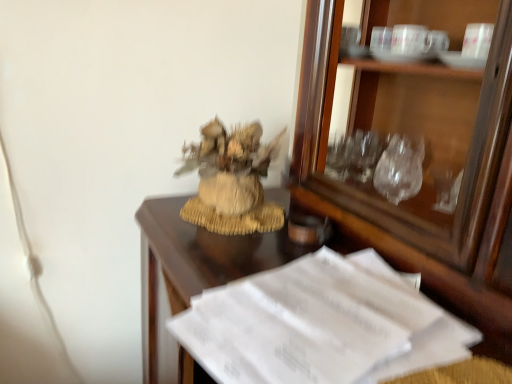
Question: Can you confirm if burlap textured houseplant at center is positioned to the right of matte brown glass at center?

Choices:
 (A) yes
 (B) no

Answer: (B)

Question: From the image's perspective, is burlap textured houseplant at center on top of matte brown glass at center?

Choices:
 (A) yes
 (B) no

Answer: (A)

Question: Does burlap textured houseplant at center have a larger size compared to matte brown glass at center?

Choices:
 (A) yes
 (B) no

Answer: (A)

Question: Can you confirm if burlap textured houseplant at center is thinner than matte brown glass at center?

Choices:
 (A) yes
 (B) no

Answer: (B)

Question: From the image's perspective, would you say burlap textured houseplant at center is shown under matte brown glass at center?

Choices:
 (A) no
 (B) yes

Answer: (A)

Question: Can we say burlap textured houseplant at center lies outside matte brown glass at center?

Choices:
 (A) yes
 (B) no

Answer: (A)

Question: Does white paper at lower right have a lesser width compared to matte brown glass at center?

Choices:
 (A) yes
 (B) no

Answer: (B)

Question: Considering the relative positions of white paper at lower right and matte brown glass at center in the image provided, is white paper at lower right to the left of matte brown glass at center from the viewer's perspective?

Choices:
 (A) no
 (B) yes

Answer: (B)

Question: Is white paper at lower right facing away from matte brown glass at center?

Choices:
 (A) yes
 (B) no

Answer: (B)

Question: Is white paper at lower right not close to matte brown glass at center?

Choices:
 (A) yes
 (B) no

Answer: (B)

Question: Is matte brown glass at center located within white paper at lower right?

Choices:
 (A) no
 (B) yes

Answer: (A)

Question: Can you confirm if white paper at lower right is taller than matte brown glass at center?

Choices:
 (A) yes
 (B) no

Answer: (A)

Question: Can you confirm if burlap textured houseplant at center is shorter than white paper at lower right?

Choices:
 (A) no
 (B) yes

Answer: (A)